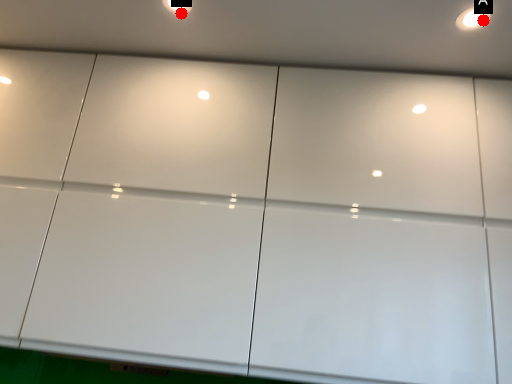
Question: Two points are circled on the image, labeled by A and B beside each circle. Among these points, which one is nearest to the camera?

Choices:
 (A) A is closer
 (B) B is closer

Answer: (A)